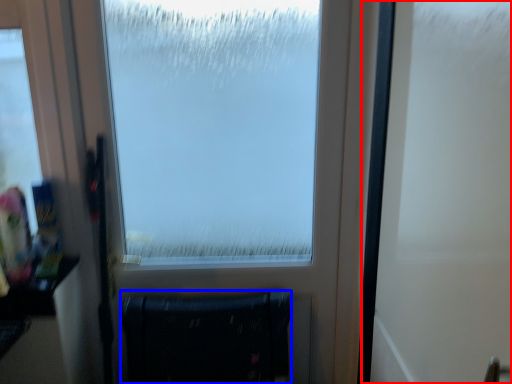
Question: Among these objects, which one is nearest to the camera, screen door (highlighted by a red box) or furniture (highlighted by a blue box)?

Choices:
 (A) screen door
 (B) furniture

Answer: (A)